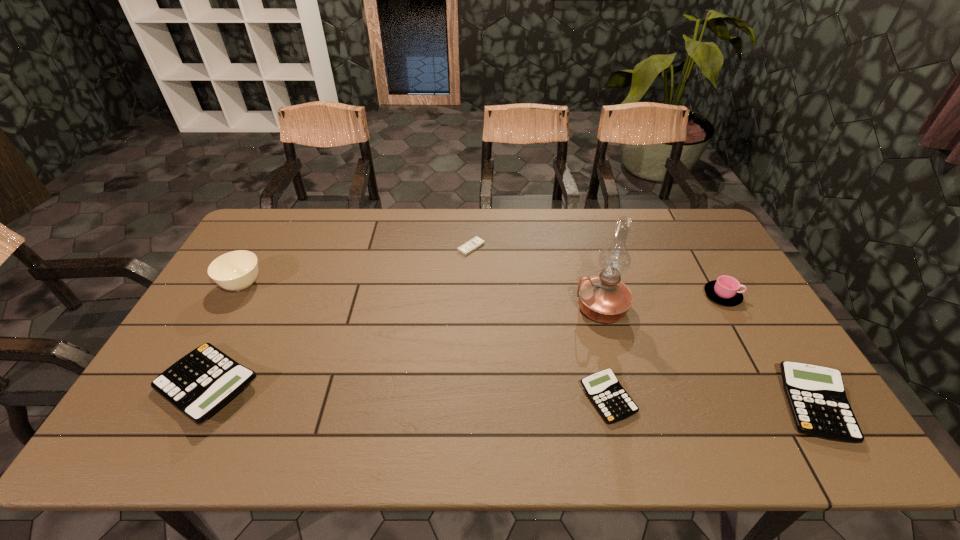
Identify which calculator is located as the nearest to the cup. Please provide its 2D coordinates. Your answer should be formatted as a tuple, i.e. [(x, y)], where the tuple contains the x and y coordinates of a point satisfying the conditions above.

[(816, 395)]

Find the location of `calculator object that ranks as the second closest to the second tallest object`. calculator object that ranks as the second closest to the second tallest object is located at coordinates (614, 404).

The width and height of the screenshot is (960, 540). I want to click on vacant area that satisfies the following two spatial constraints: 1. on the back side of the fifth object from right to left; 2. on the right side of the leftmost calculator, so click(x=280, y=247).

Locate an element on the screen. This screenshot has width=960, height=540. vacant space that satisfies the following two spatial constraints: 1. on the side with the handle of the cup; 2. on the left side of the rightmost calculator is located at coordinates (783, 405).